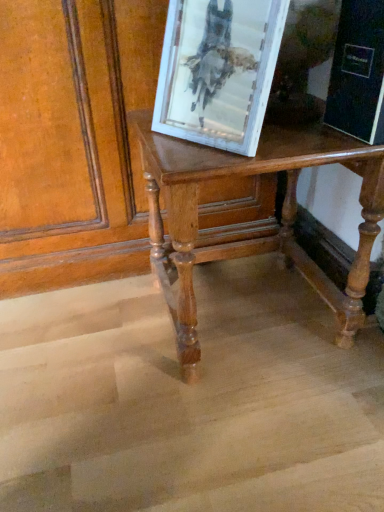
Question: Is shiny polished wood table at center at the left side of white distressed wood picture frame at upper center?

Choices:
 (A) no
 (B) yes

Answer: (A)

Question: Is shiny polished wood table at center wider than white distressed wood picture frame at upper center?

Choices:
 (A) yes
 (B) no

Answer: (A)

Question: Is shiny polished wood table at center facing towards white distressed wood picture frame at upper center?

Choices:
 (A) yes
 (B) no

Answer: (B)

Question: Is shiny polished wood table at center oriented away from white distressed wood picture frame at upper center?

Choices:
 (A) no
 (B) yes

Answer: (A)

Question: Is shiny polished wood table at center closer to camera compared to white distressed wood picture frame at upper center?

Choices:
 (A) yes
 (B) no

Answer: (B)

Question: Is shiny polished wood table at center far away from white distressed wood picture frame at upper center?

Choices:
 (A) yes
 (B) no

Answer: (B)

Question: Is the surface of white distressed wood picture frame at upper center in direct contact with shiny polished wood table at center?

Choices:
 (A) yes
 (B) no

Answer: (B)

Question: Does white distressed wood picture frame at upper center have a greater height compared to shiny polished wood table at center?

Choices:
 (A) no
 (B) yes

Answer: (A)

Question: Is shiny polished wood table at center completely or partially inside white distressed wood picture frame at upper center?

Choices:
 (A) no
 (B) yes

Answer: (A)

Question: Considering the relative sizes of white distressed wood picture frame at upper center and shiny polished wood table at center in the image provided, is white distressed wood picture frame at upper center wider than shiny polished wood table at center?

Choices:
 (A) yes
 (B) no

Answer: (B)

Question: Can you confirm if white distressed wood picture frame at upper center is bigger than shiny polished wood table at center?

Choices:
 (A) yes
 (B) no

Answer: (B)

Question: From a real-world perspective, does white distressed wood picture frame at upper center sit lower than shiny polished wood table at center?

Choices:
 (A) yes
 (B) no

Answer: (B)

Question: In terms of width, does shiny polished wood table at center look wider or thinner when compared to white distressed wood picture frame at upper center?

Choices:
 (A) thin
 (B) wide

Answer: (B)